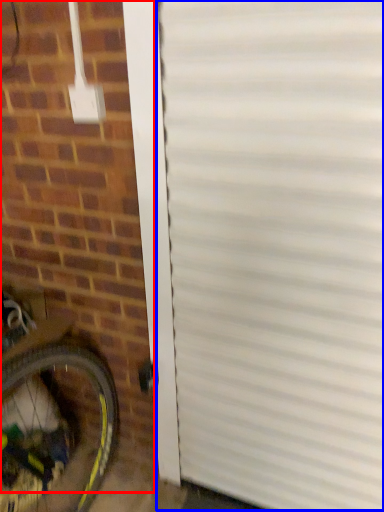
Question: Which point is closer to the camera, brickwork (highlighted by a red box) or garage door (highlighted by a blue box)?

Choices:
 (A) brickwork
 (B) garage door

Answer: (A)